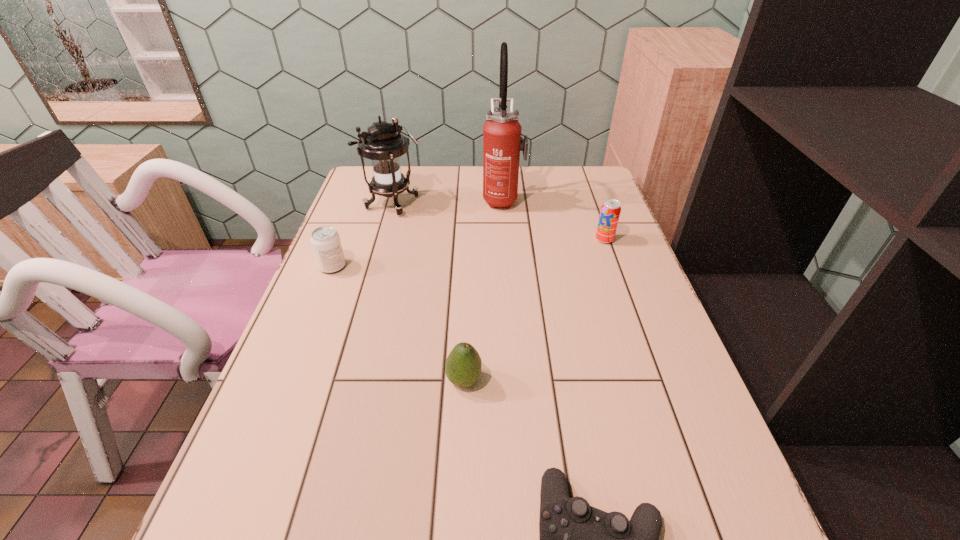
Locate an element on the screen. The width and height of the screenshot is (960, 540). vacant position located 0.200m at the nozzle of the fire extinguisher is located at coordinates pyautogui.click(x=420, y=199).

Where is `free spot located on the right of the second tallest object`? free spot located on the right of the second tallest object is located at coordinates (468, 204).

Locate an element on the screen. Image resolution: width=960 pixels, height=540 pixels. free point located 0.370m on the back of the third farthest object is located at coordinates (581, 173).

Identify the location of vacant space located on the back of the left soda can. (359, 200).

The width and height of the screenshot is (960, 540). I want to click on vacant region located on the left of the avocado, so click(328, 380).

The width and height of the screenshot is (960, 540). I want to click on fire extinguisher located in the far edge section of the desktop, so click(x=502, y=142).

Image resolution: width=960 pixels, height=540 pixels. What are the coordinates of `lantern that is at the far edge` in the screenshot? It's located at (383, 143).

This screenshot has width=960, height=540. Identify the location of lantern at the left edge. (383, 143).

This screenshot has width=960, height=540. I want to click on soda can located at the left edge, so click(x=325, y=240).

I want to click on object that is at the right edge, so click(x=610, y=211).